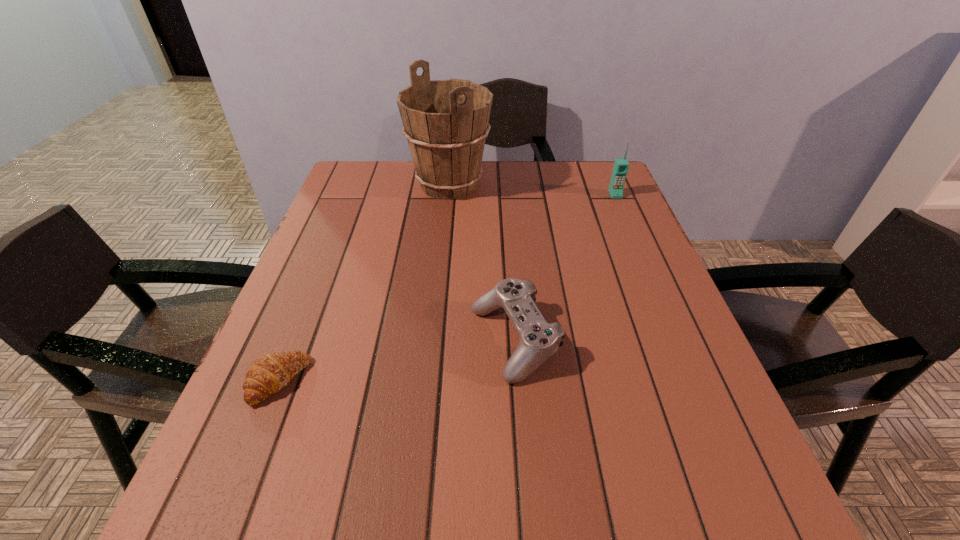
Locate an element on the screen. vacant region at the far right corner of the desktop is located at coordinates (611, 174).

I want to click on vacant space at the near right corner of the desktop, so click(x=680, y=514).

Where is `vacant area that lies between the cellular telephone and the control`? vacant area that lies between the cellular telephone and the control is located at coordinates [564, 268].

This screenshot has height=540, width=960. I want to click on free point between the shortest object and the bucket, so click(364, 283).

The image size is (960, 540). What are the coordinates of `vacant space in between the control and the leftmost object` in the screenshot? It's located at (396, 361).

At what (x,y) coordinates should I click in order to perform the action: click on empty space that is in between the rightmost object and the third tallest object. Please return your answer as a coordinate pair (x, y). Looking at the image, I should click on (564, 268).

This screenshot has height=540, width=960. What are the coordinates of `free space between the tallest object and the rightmost object` in the screenshot? It's located at (533, 190).

Where is `empty location between the rightmost object and the leftmost object`? The width and height of the screenshot is (960, 540). empty location between the rightmost object and the leftmost object is located at coordinates (446, 288).

You are a GUI agent. You are given a task and a screenshot of the screen. Output one action in this format:
    pyautogui.click(x=<x>, y=<y>)
    Task: Click on the empty space that is in between the leftmost object and the cellular telephone
    This screenshot has width=960, height=540.
    Given the screenshot: What is the action you would take?
    pyautogui.click(x=446, y=288)

This screenshot has width=960, height=540. What are the coordinates of `free space between the cellular telephone and the control` in the screenshot? It's located at (564, 268).